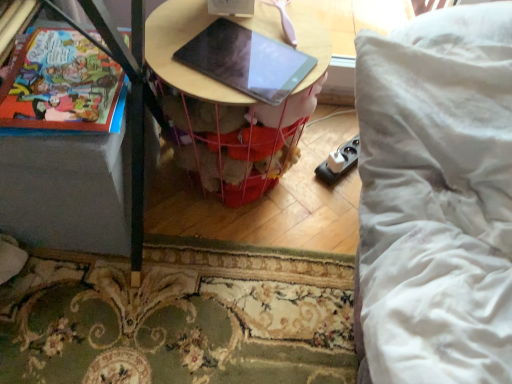
Identify the location of free space above matte black tablet at center (from a real-world perspective). (255, 61).